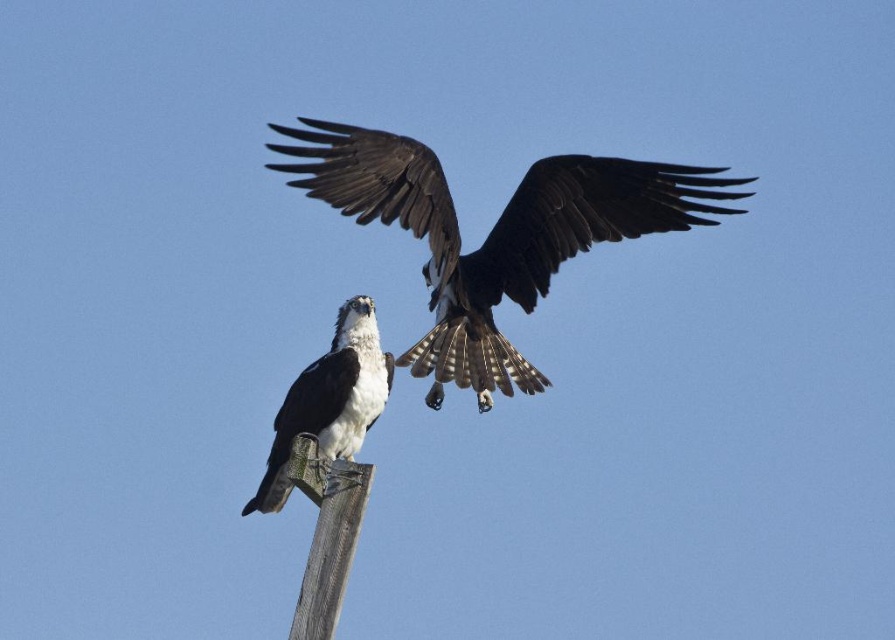
Does point (326, 403) lie behind point (312, 554)?

Yes.

Locate an element on the screen. This screenshot has height=640, width=895. white-feathered eagle at center is located at coordinates (329, 401).

Find the location of `white-feathered eagle at center`. white-feathered eagle at center is located at coordinates (329, 401).

Can you confirm if dark brown feathers at center is taller than wooden post at center?

Correct, dark brown feathers at center is much taller as wooden post at center.

Looking at this image, between dark brown feathers at center and wooden post at center, which one appears on the left side from the viewer's perspective?

wooden post at center

Which is behind, point (576, 237) or point (334, 550)?

The point (576, 237) is more distant.

The height and width of the screenshot is (640, 895). In order to click on dark brown feathers at center in this screenshot , I will do `click(493, 234)`.

Which of these two, dark brown feathers at center or white-feathered eagle at center, stands taller?

dark brown feathers at center is taller.

Between dark brown feathers at center and white-feathered eagle at center, which one has less height?

Standing shorter between the two is white-feathered eagle at center.

Where is `dark brown feathers at center`? This screenshot has height=640, width=895. dark brown feathers at center is located at coordinates (493, 234).